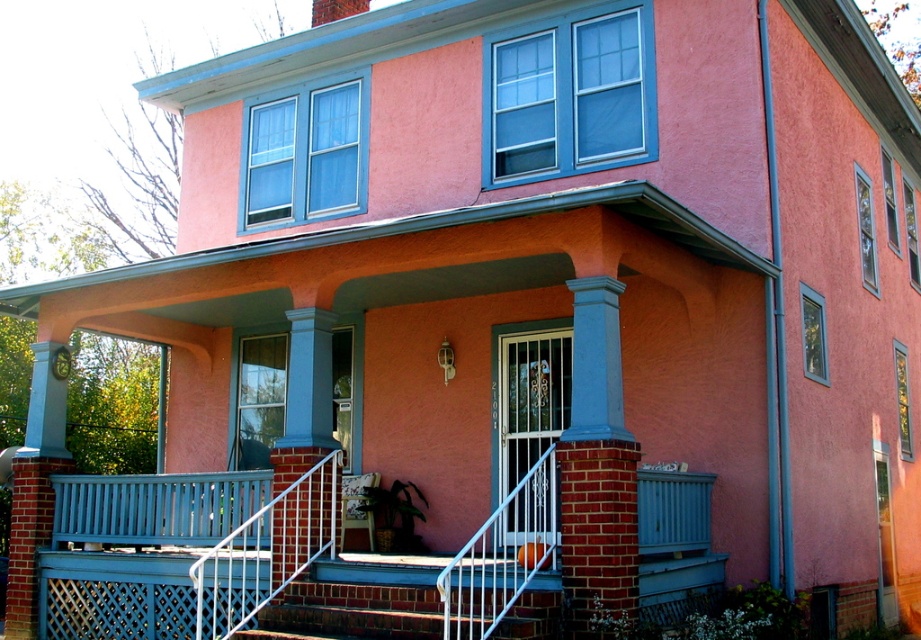
Question: Among these objects, which one is nearest to the camera?

Choices:
 (A) blue painted brick column at center
 (B) white metal railing at center
 (C) smooth white railing at center
 (D) white metal railing at lower center

Answer: (B)

Question: Which is nearer to the brick stairs at center?

Choices:
 (A) white metal railing at center
 (B) smooth white railing at center

Answer: (A)

Question: From the image, what is the correct spatial relationship of smooth white railing at center in relation to white metal railing at center?

Choices:
 (A) above
 (B) below

Answer: (A)

Question: Does smooth white railing at center appear over brick stairs at center?

Choices:
 (A) no
 (B) yes

Answer: (B)

Question: Which of these objects is positioned farthest from the brick stairs at center?

Choices:
 (A) smooth white railing at center
 (B) blue painted brick column at center
 (C) white metal railing at lower center
 (D) white metal railing at center

Answer: (B)

Question: Is white metal railing at center wider than brick stairs at center?

Choices:
 (A) no
 (B) yes

Answer: (A)